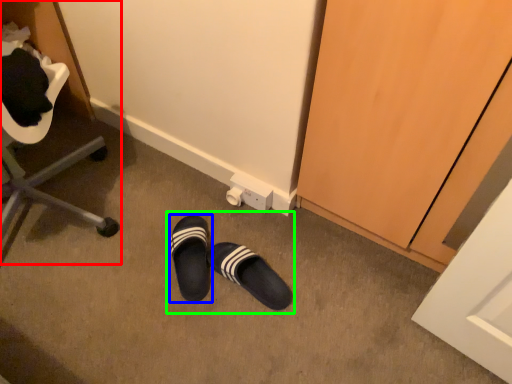
Question: Based on their relative distances, which object is nearer to furniture (highlighted by a red box)? Choose from footwear (highlighted by a blue box) and leather shoe (highlighted by a green box).

Choices:
 (A) footwear
 (B) leather shoe

Answer: (B)